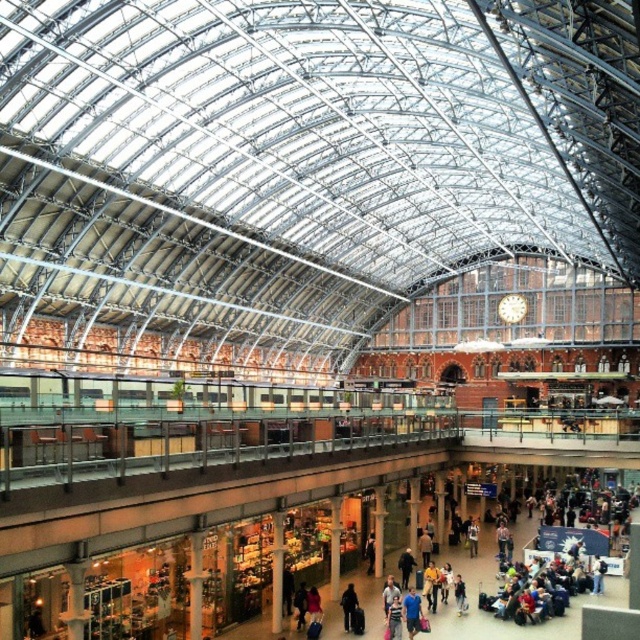
You are a traveler at St Pancras International railway station. You see a dark brown leather jacket at center and dark blue jeans at center. Which item is taller?

The dark brown leather jacket at center is taller than the dark blue jeans at center.

You are standing in the main concourse of St Pancras International railway station and notice a person wearing a blue cotton shirt at lower center and dark blue jeans at center. From your perspective, which clothing item appears closer to you?

The blue cotton shirt at lower center appears closer because it is positioned in front of the dark blue jeans at center.